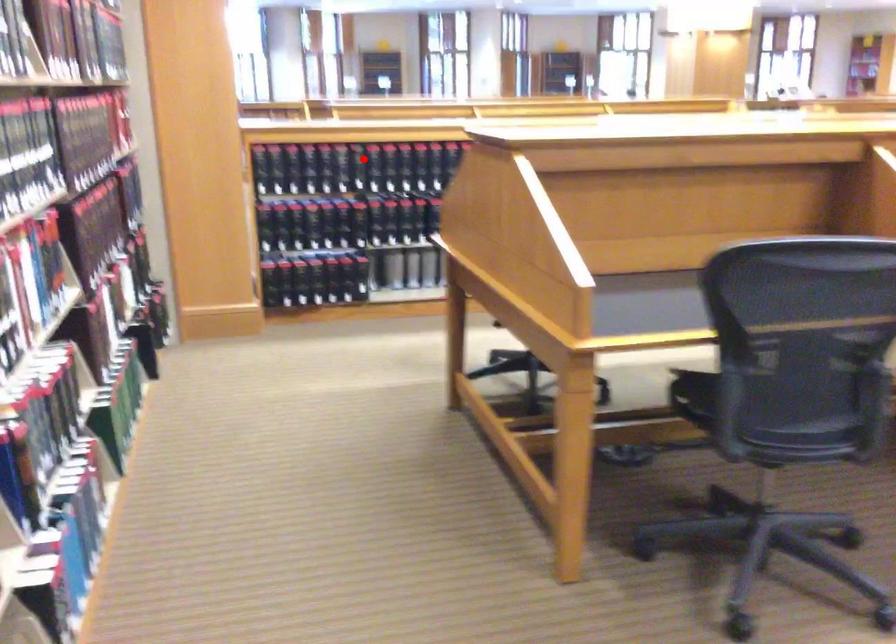
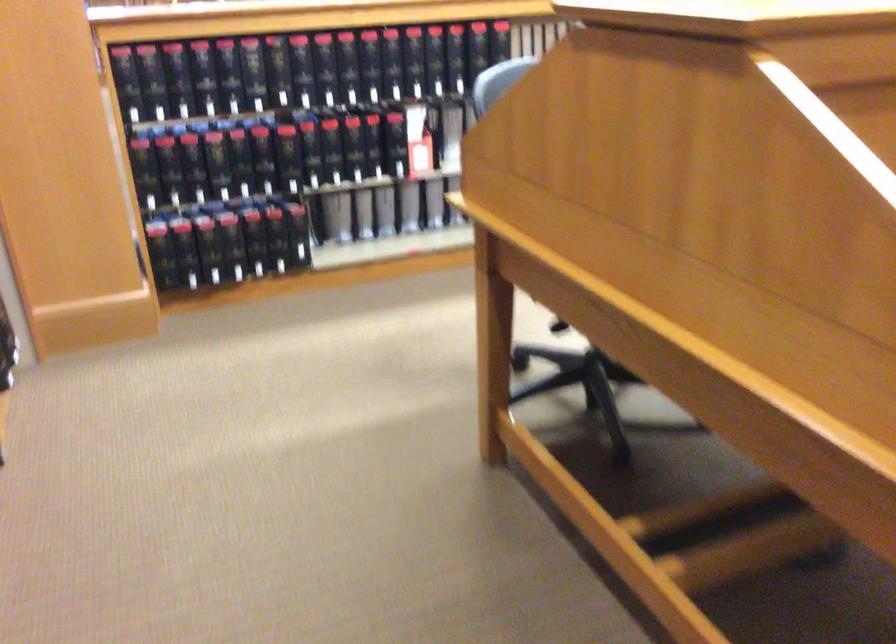
Question: A red point is marked in image1. In image2, is the corresponding 3D point closer to the camera or farther? Reply with the corresponding letter.

Choices:
 (A) The corresponding 3D point is closer.
 (B) The corresponding 3D point is farther.

Answer: (A)